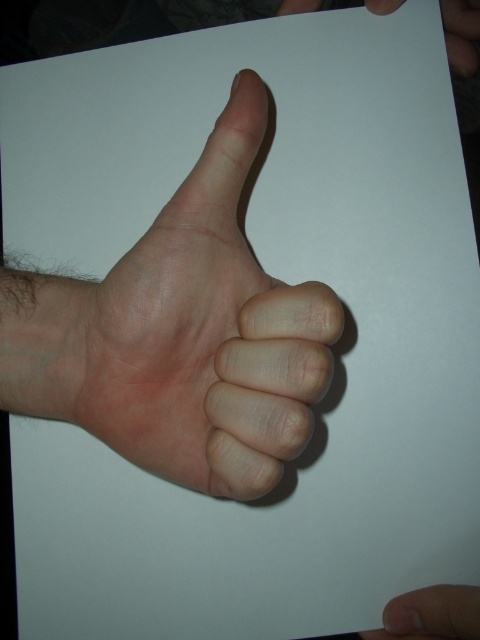
You are an artist trying to paint the scene. You notice two areas of smooth skin in the image. Which one is closer to you, the smooth skin at lower right or the smooth skin hand at upper right?

The smooth skin at lower right is closer to you because it is in front of the smooth skin hand at upper right.